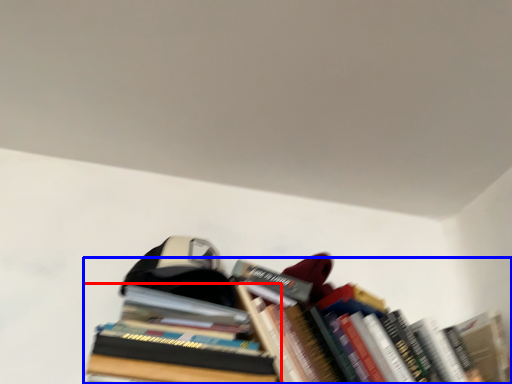
Question: Which object appears farthest to the camera in this image, book (highlighted by a red box) or book (highlighted by a blue box)?

Choices:
 (A) book
 (B) book

Answer: (B)